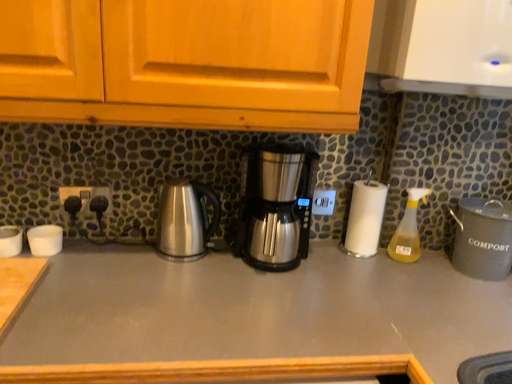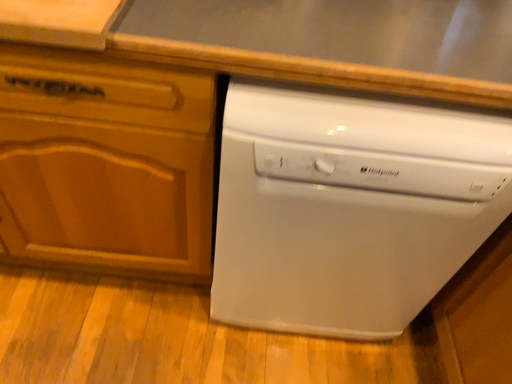
Question: Which way did the camera rotate in the video?

Choices:
 (A) rotated upward
 (B) rotated downward

Answer: (B)